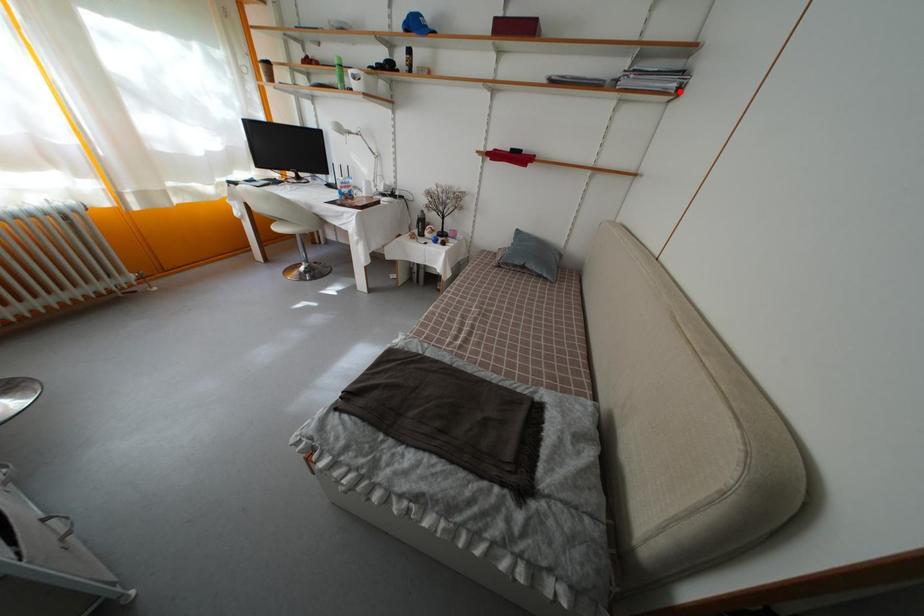
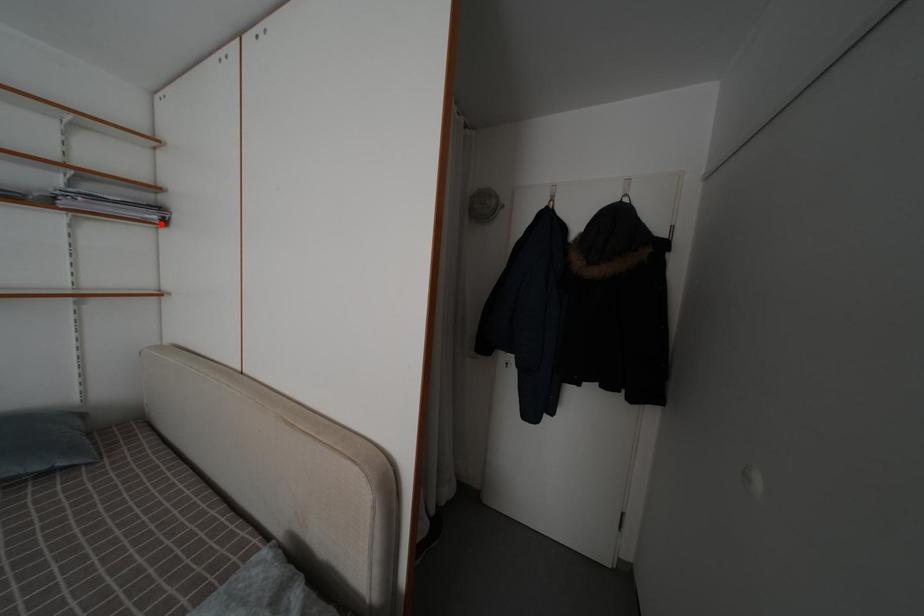
I am providing you with two images of the same scene from different viewpoints. A red point is marked on the first image and another point is marked on the second image. Do the highlighted points in image1 and image2 indicate the same real-world spot?

Yes